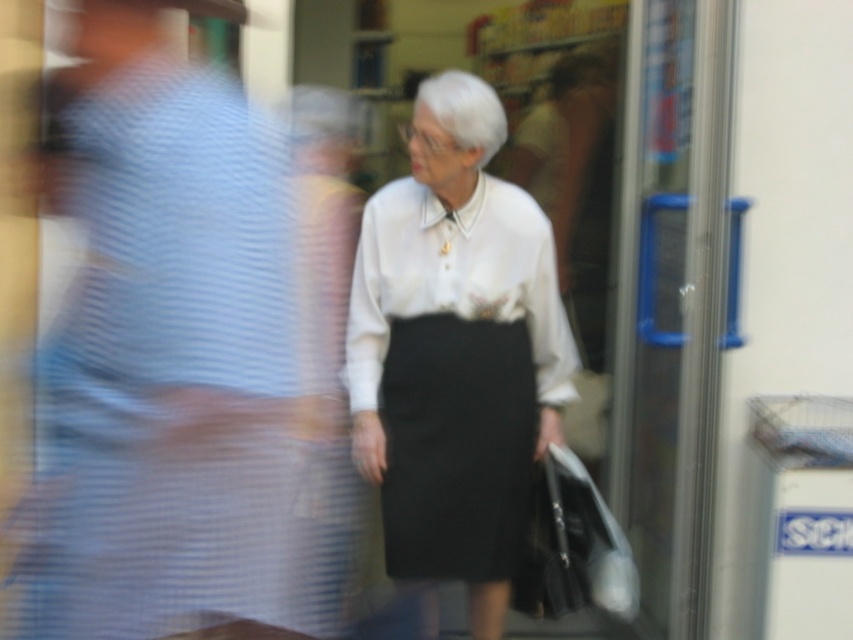
Does white matte blouse at center come behind white matte shopping bag at lower right?

No, white matte blouse at center is in front of white matte shopping bag at lower right.

Is white matte blouse at center below white matte shopping bag at lower right?

Incorrect, white matte blouse at center is not positioned below white matte shopping bag at lower right.

Which is in front, point (453, 396) or point (579, 474)?

Positioned in front is point (453, 396).

The image size is (853, 640). What are the coordinates of `white matte blouse at center` in the screenshot? It's located at (454, 353).

Is white satin blouse at center wider than white matte shopping bag at lower right?

Yes.

From the picture: Who is more forward, (456, 211) or (602, 515)?

Positioned in front is point (602, 515).

At what (x,y) coordinates should I click in order to perform the action: click on white satin blouse at center. Please return your answer as a coordinate pair (x, y). Looking at the image, I should click on (456, 278).

Can you confirm if white matte blouse at center is wider than white satin blouse at center?

Incorrect, white matte blouse at center's width does not surpass white satin blouse at center's.

Who is shorter, white matte blouse at center or white satin blouse at center?

white satin blouse at center

What do you see at coordinates (454, 353) in the screenshot?
I see `white matte blouse at center` at bounding box center [454, 353].

Where is `white matte blouse at center`? The image size is (853, 640). white matte blouse at center is located at coordinates (454, 353).